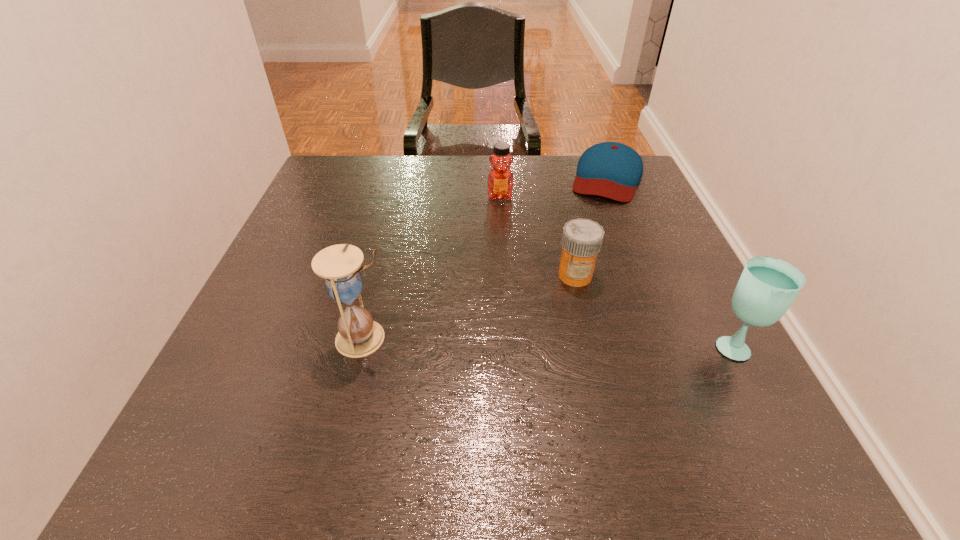
Locate which object is the second closest to the tallest object. Please provide its 2D coordinates. Your answer should be formatted as a tuple, i.e. [(x, y)], where the tuple contains the x and y coordinates of a point satisfying the conditions above.

[(500, 181)]

The width and height of the screenshot is (960, 540). Identify the location of vacant space that satisfies the following two spatial constraints: 1. on the back side of the tallest object; 2. on the left side of the baseball cap. (404, 178).